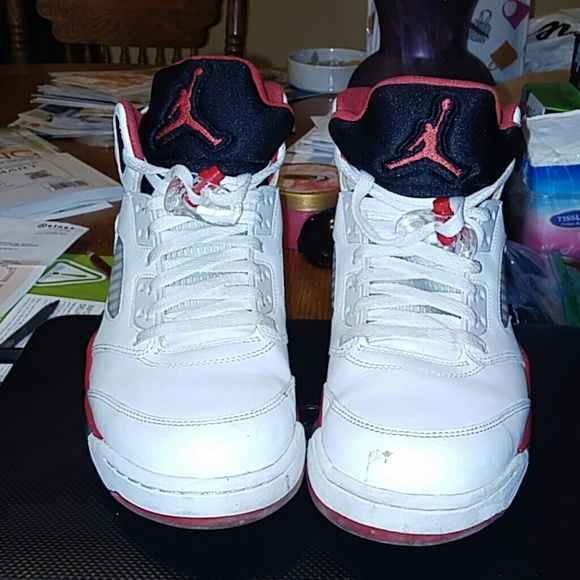
You are a GUI agent. You are given a task and a screenshot of the screen. Output one action in this format:
    pyautogui.click(x=<x>, y=<y>)
    Task: Click on the chair
    
    Given the screenshot: What is the action you would take?
    pyautogui.click(x=134, y=32)